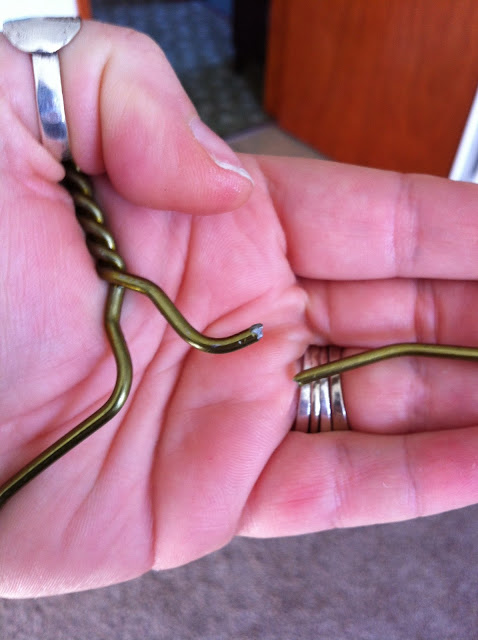
The width and height of the screenshot is (478, 640). Find the location of `brown door`. brown door is located at coordinates (378, 68).